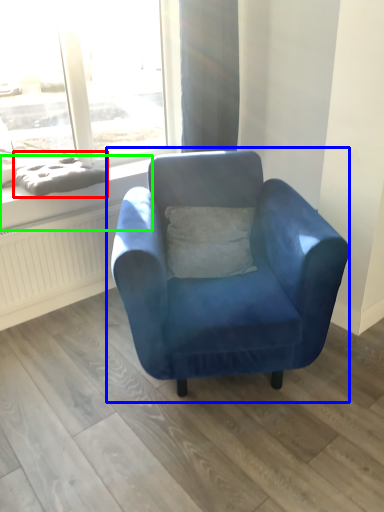
Question: Which object is the closest to the material (highlighted by a red box)? Choose among these: chair (highlighted by a blue box) or window sill (highlighted by a green box).

Choices:
 (A) chair
 (B) window sill

Answer: (B)